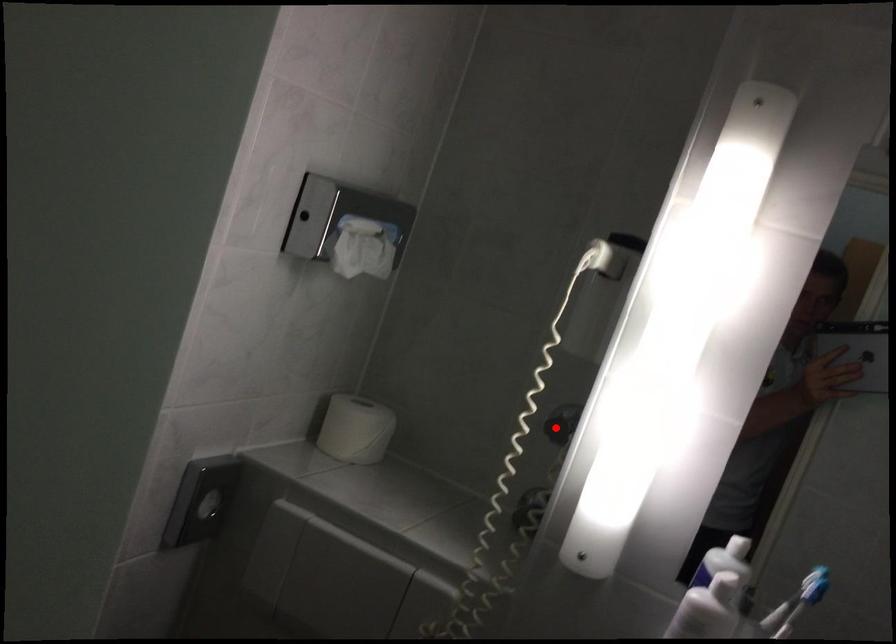
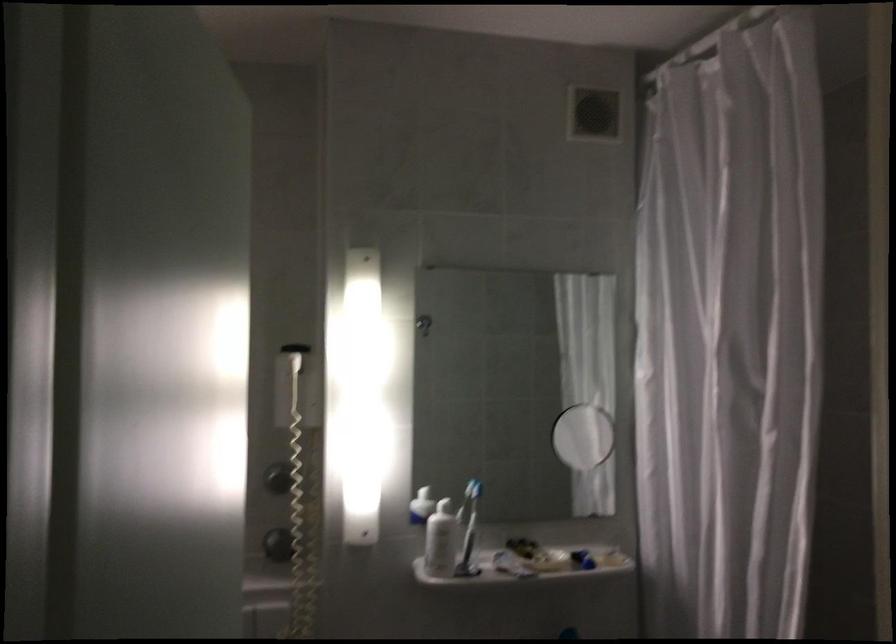
Question: I am providing you with two images of the same scene from different viewpoints. In image1, a red point is highlighted. Considering the same 3D point in image2, which of the following is correct?

Choices:
 (A) It is closer
 (B) It is farther

Answer: (B)